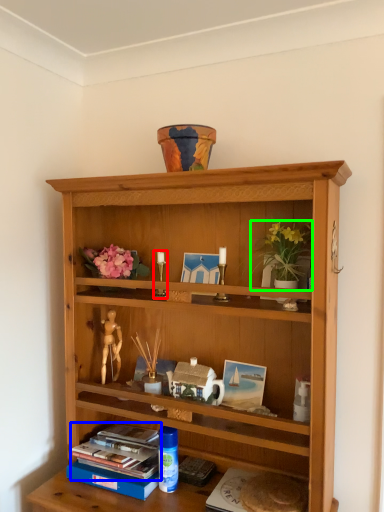
Question: Based on their relative distances, which object is farther from candle holder (highlighted by a red box)? Choose from book (highlighted by a blue box) and houseplant (highlighted by a green box).

Choices:
 (A) book
 (B) houseplant

Answer: (A)